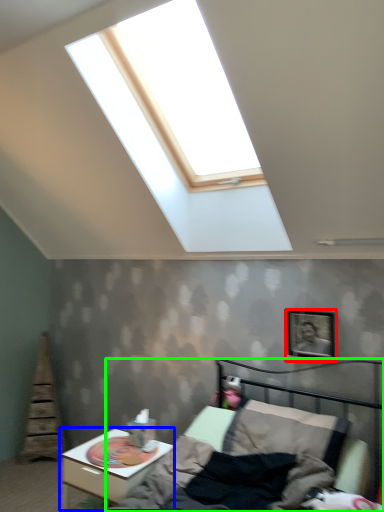
Question: Based on their relative distances, which object is nearer to picture frame (highlighted by a red box)? Choose from nightstand (highlighted by a blue box) and bed (highlighted by a green box).

Choices:
 (A) nightstand
 (B) bed

Answer: (B)